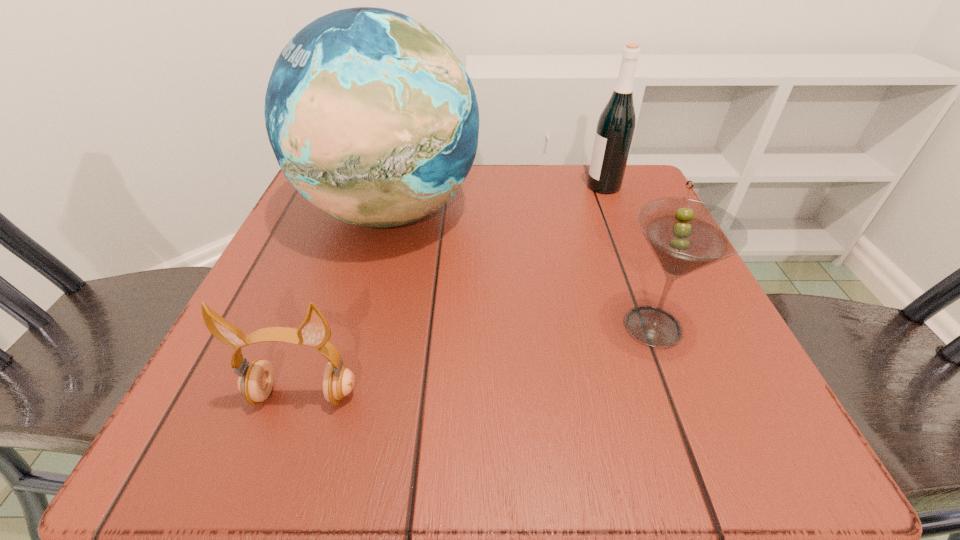
Identify the location of free spot that satisfies the following two spatial constraints: 1. on the label of the wine bottle; 2. on the front side of the third tallest object. The height and width of the screenshot is (540, 960). (660, 326).

In order to click on free space that satisfies the following two spatial constraints: 1. on the label of the second tallest object; 2. on the front side of the second shortest object in this screenshot , I will do 660,326.

I want to click on free space that satisfies the following two spatial constraints: 1. on the label of the third shortest object; 2. on the front-facing side of the earphone, so click(687, 395).